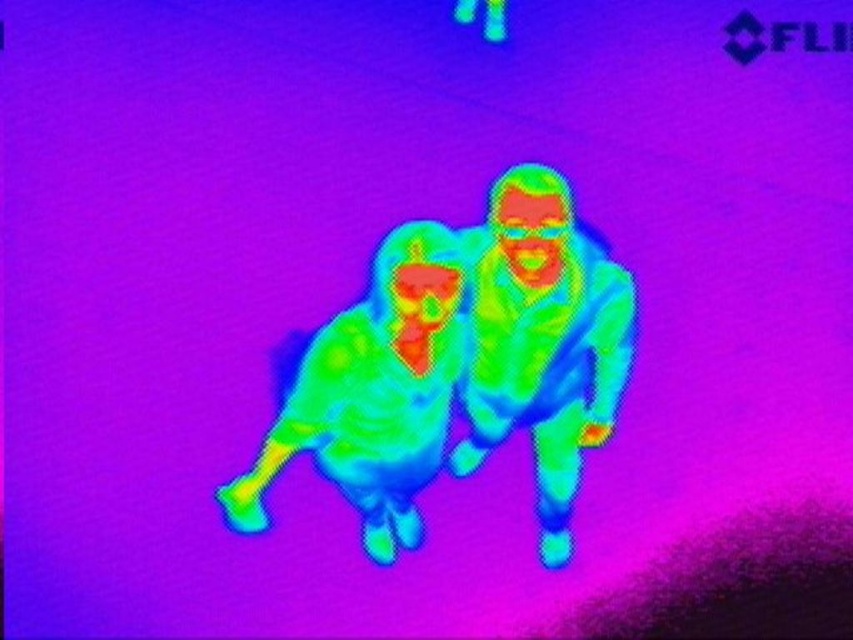
Question: Is green matte figure at center below greenish-yellow fabric at center?

Choices:
 (A) no
 (B) yes

Answer: (A)

Question: Considering the relative positions of green matte figure at center and greenish-yellow fabric at center in the image provided, where is green matte figure at center located with respect to greenish-yellow fabric at center?

Choices:
 (A) below
 (B) above

Answer: (B)

Question: Which point is farther to the camera?

Choices:
 (A) (281, 429)
 (B) (560, 314)

Answer: (B)

Question: Can you confirm if green matte figure at center is positioned below greenish-yellow fabric at center?

Choices:
 (A) no
 (B) yes

Answer: (A)

Question: Which point is closer to the camera?

Choices:
 (A) greenish-yellow fabric at center
 (B) green matte figure at center

Answer: (A)